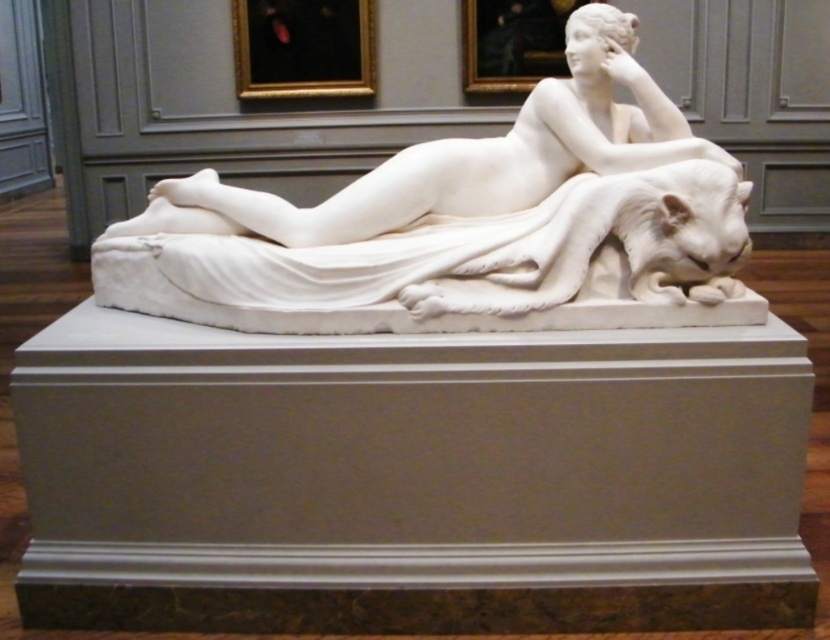
Which is more to the left, white marble sculpture at center or white marble statue at center?

Positioned to the left is white marble statue at center.

Identify the location of white marble sculpture at center. This screenshot has height=640, width=830. (462, 266).

At what (x,y) coordinates should I click in order to perform the action: click on white marble sculpture at center. Please return your answer as a coordinate pair (x, y). The width and height of the screenshot is (830, 640). Looking at the image, I should click on (462, 266).